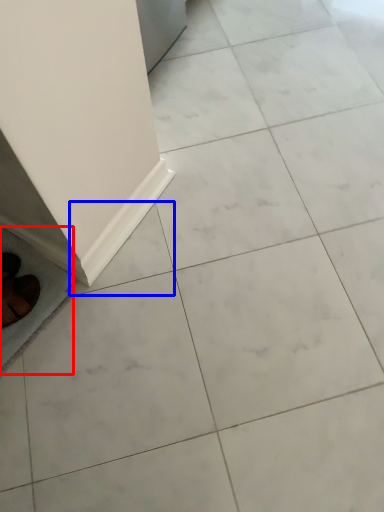
Question: Which object is further to the camera taking this photo, ceramic tile (highlighted by a red box) or ceramic tile (highlighted by a blue box)?

Choices:
 (A) ceramic tile
 (B) ceramic tile

Answer: (B)